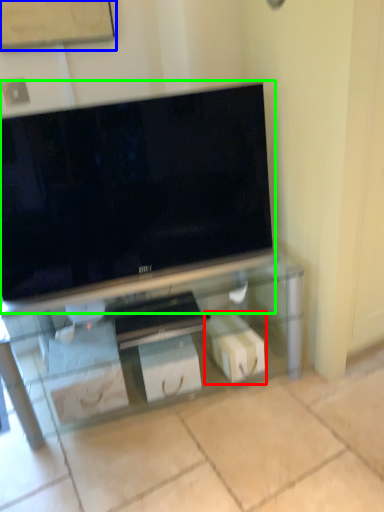
Question: Which object is the farthest from box (highlighted by a red box)? Choose among these: bulletin board (highlighted by a blue box) or television (highlighted by a green box).

Choices:
 (A) bulletin board
 (B) television

Answer: (A)